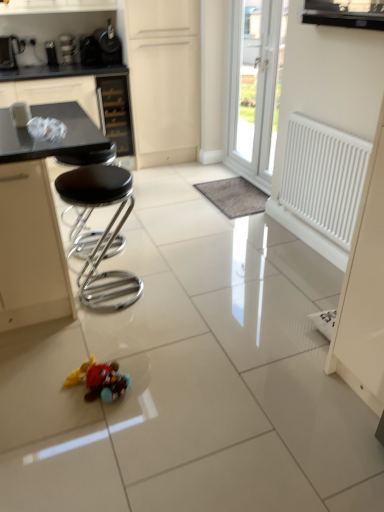
Question: Considering the relative sizes of brushed metal toaster at upper left, which appears as the first appliance when viewed from the left, and white plastic door at upper center in the image provided, is brushed metal toaster at upper left, which appears as the first appliance when viewed from the left, taller than white plastic door at upper center?

Choices:
 (A) yes
 (B) no

Answer: (B)

Question: Is brushed metal toaster at upper left, which is the third appliance from right to left, aimed at white plastic door at upper center?

Choices:
 (A) no
 (B) yes

Answer: (A)

Question: Is brushed metal toaster at upper left, which appears as the first appliance when viewed from the left, bigger than white plastic door at upper center?

Choices:
 (A) yes
 (B) no

Answer: (B)

Question: Considering the relative sizes of brushed metal toaster at upper left, which appears as the first appliance when viewed from the left, and white plastic door at upper center in the image provided, is brushed metal toaster at upper left, which appears as the first appliance when viewed from the left, wider than white plastic door at upper center?

Choices:
 (A) yes
 (B) no

Answer: (A)

Question: Is brushed metal toaster at upper left, which is the third appliance from right to left, at the left side of white plastic door at upper center?

Choices:
 (A) no
 (B) yes

Answer: (B)

Question: From their relative heights in the image, would you say gray fuzzy mat at center is taller or shorter than black glass drawer at upper center?

Choices:
 (A) short
 (B) tall

Answer: (A)

Question: Considering the positions of gray fuzzy mat at center and black glass drawer at upper center in the image, is gray fuzzy mat at center wider or thinner than black glass drawer at upper center?

Choices:
 (A) thin
 (B) wide

Answer: (A)

Question: Is gray fuzzy mat at center to the left or to the right of black glass drawer at upper center in the image?

Choices:
 (A) right
 (B) left

Answer: (A)

Question: Is gray fuzzy mat at center situated inside black glass drawer at upper center or outside?

Choices:
 (A) inside
 (B) outside

Answer: (B)

Question: Considering the positions of point (62, 49) and point (3, 66), is point (62, 49) closer or farther from the camera than point (3, 66)?

Choices:
 (A) closer
 (B) farther

Answer: (B)

Question: From the image's perspective, is metallic silver toaster at upper left, which is the second appliance in right-to-left order, above or below brushed metal toaster at upper left, which appears as the first appliance when viewed from the left?

Choices:
 (A) below
 (B) above

Answer: (B)

Question: Relative to brushed metal toaster at upper left, which appears as the first appliance when viewed from the left, is metallic silver toaster at upper left, which is the second appliance in right-to-left order, in front or behind?

Choices:
 (A) behind
 (B) front

Answer: (A)

Question: From their relative heights in the image, would you say metallic silver toaster at upper left, which ranks as the second appliance in left-to-right order, is taller or shorter than brushed metal toaster at upper left, which appears as the first appliance when viewed from the left?

Choices:
 (A) short
 (B) tall

Answer: (A)

Question: Is brushed metal toaster at upper left, which appears as the first appliance when viewed from the left, wider or thinner than plush toy at center?

Choices:
 (A) wide
 (B) thin

Answer: (B)

Question: Is brushed metal toaster at upper left, which is the third appliance from right to left, to the left or to the right of plush toy at center in the image?

Choices:
 (A) left
 (B) right

Answer: (A)